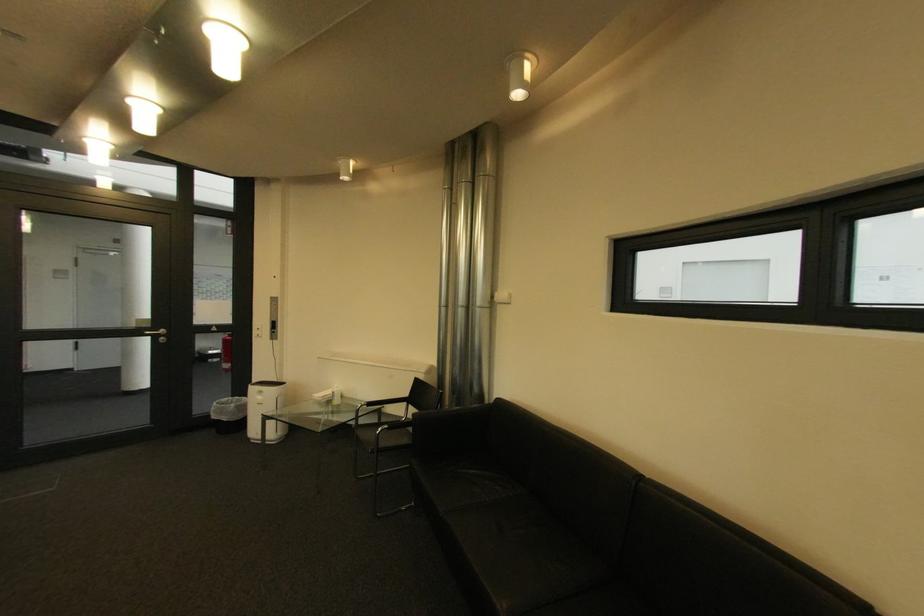
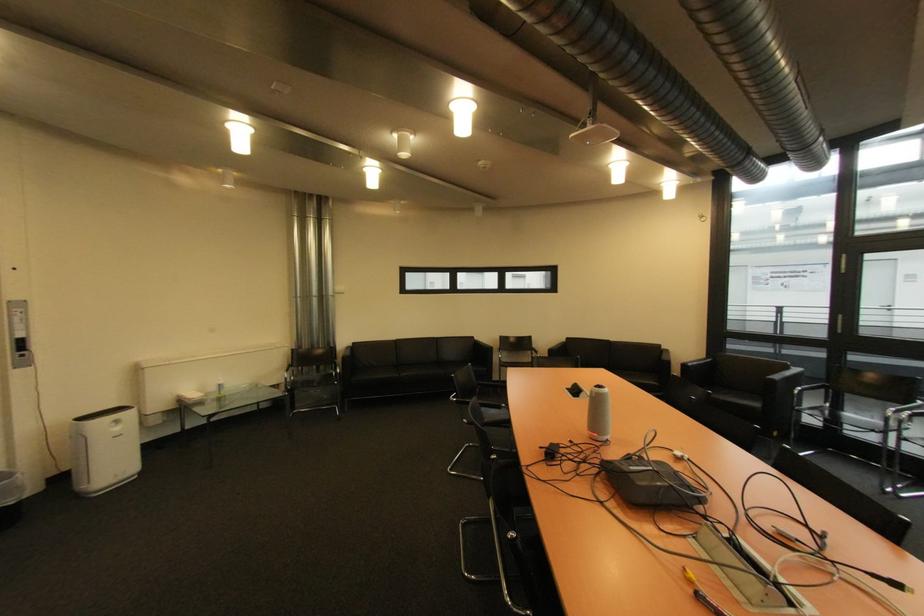
Find the pixel in the second image that matches pixel 282 334 in the first image.

(30, 357)